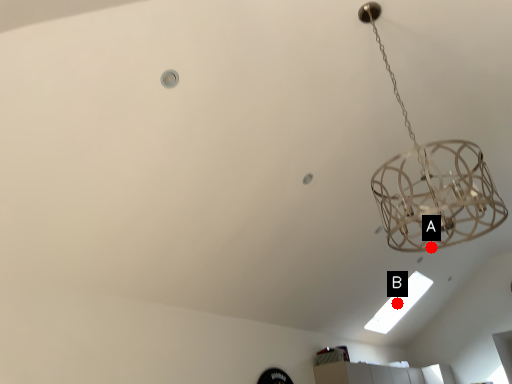
Question: Two points are circled on the image, labeled by A and B beside each circle. Which point is farther from the camera taking this photo?

Choices:
 (A) A is further
 (B) B is further

Answer: (B)